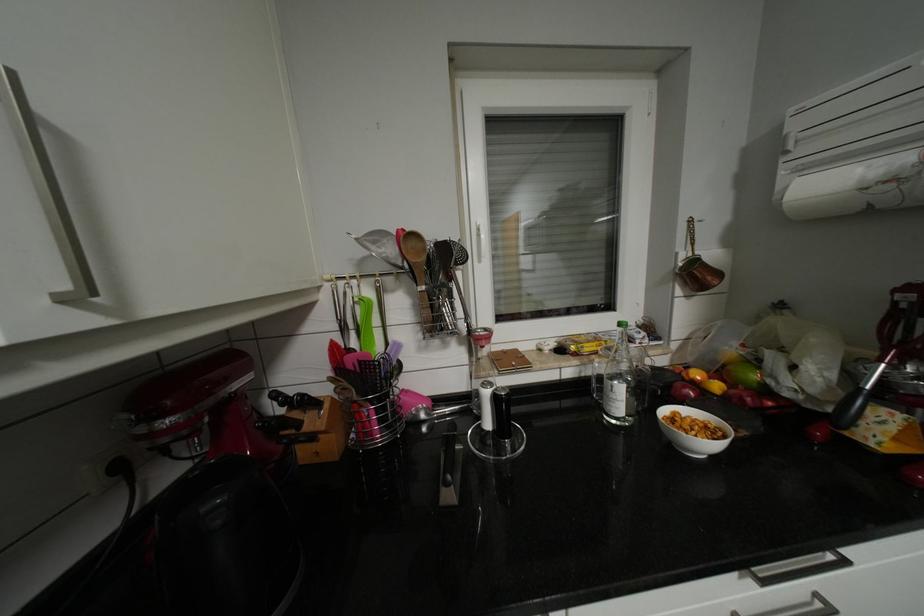
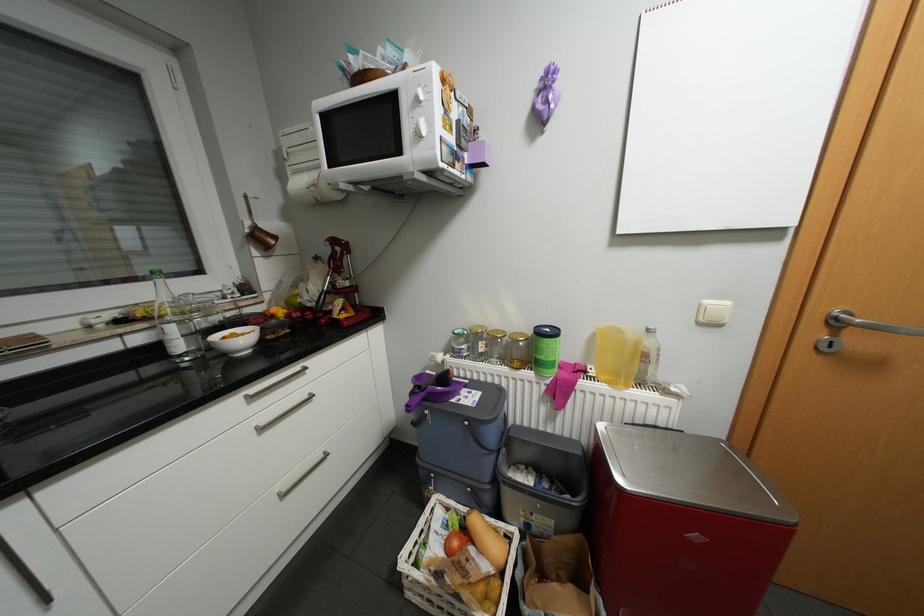
Question: The first image is from the beginning of the video and the second image is from the end. How did the camera likely rotate when shooting the video?

Choices:
 (A) Left
 (B) Right
 (C) Up
 (D) Down

Answer: (B)